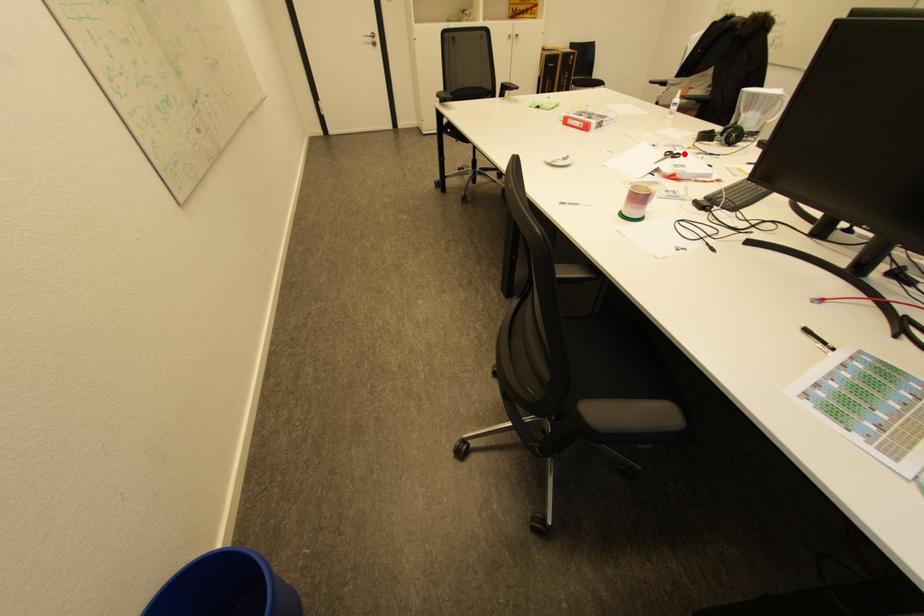
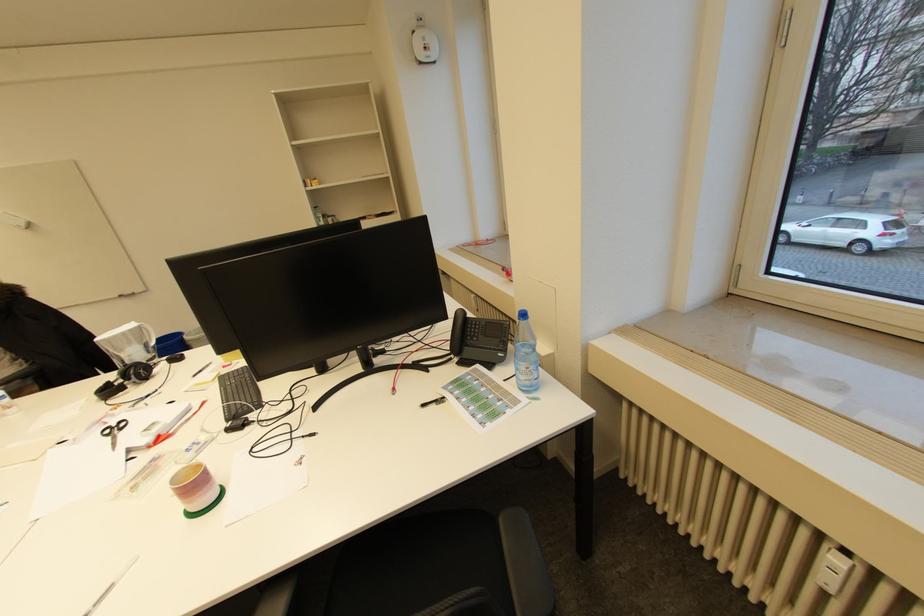
The point at the highlighted location is marked in the first image. Where is the corresponding point in the second image?

(127, 422)